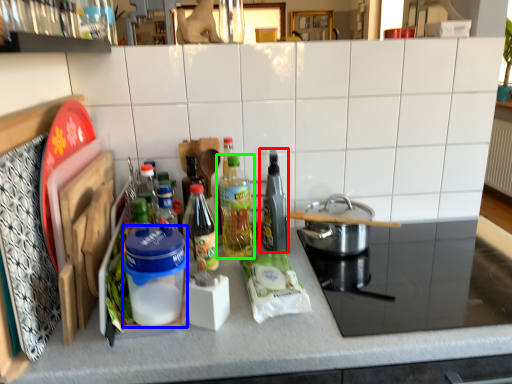
Question: Which is farther away from bottle (highlighted by a red box)? appliance (highlighted by a blue box) or bottle (highlighted by a green box)?

Choices:
 (A) appliance
 (B) bottle

Answer: (A)